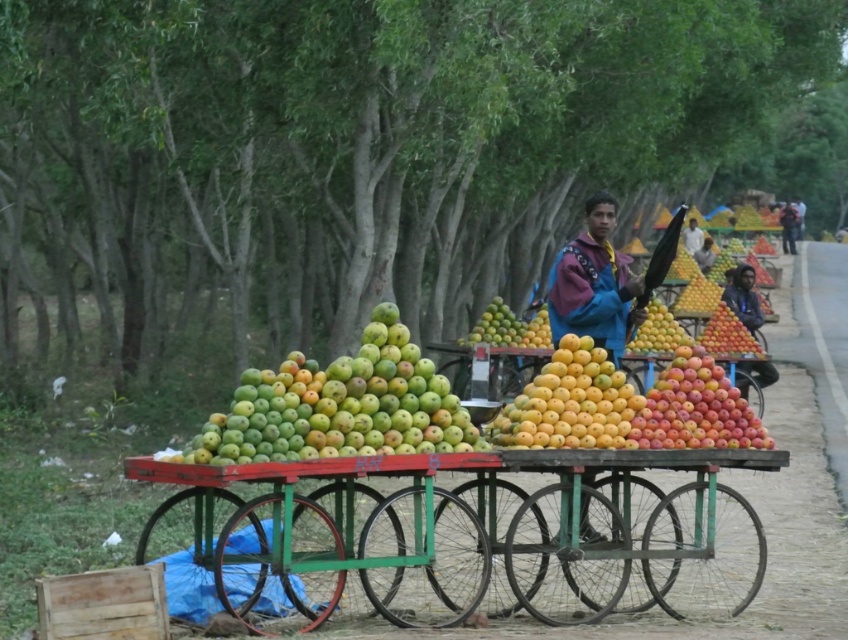
Question: Considering the real-world distances, which object is farthest from the yellow matte mangoes at center?

Choices:
 (A) shiny red apples at center
 (B) metallic green cart at center
 (C) wooden crate at lower left
 (D) green matte mangoes at center

Answer: (D)

Question: Estimate the real-world distances between objects in this image. Which object is closer to the shiny orange mangoes at right?

Choices:
 (A) green matte apples at center
 (B) wooden crate at lower left
 (C) smooth yellow mango at center
 (D) metallic green cart at center

Answer: (C)

Question: Which of these objects is positioned closest to the blue fleece jacket at center?

Choices:
 (A) smooth yellow mango at center
 (B) green matte mangoes at center
 (C) yellow matte mangoes at center
 (D) wooden crate at lower left

Answer: (C)

Question: Is blue fleece jacket at center further to camera compared to smooth yellow mango at center?

Choices:
 (A) yes
 (B) no

Answer: (B)

Question: Does green matte apples at center appear under smooth yellow mango at center?

Choices:
 (A) yes
 (B) no

Answer: (A)

Question: Is shiny red apples at center below green matte mangoes at center?

Choices:
 (A) yes
 (B) no

Answer: (A)